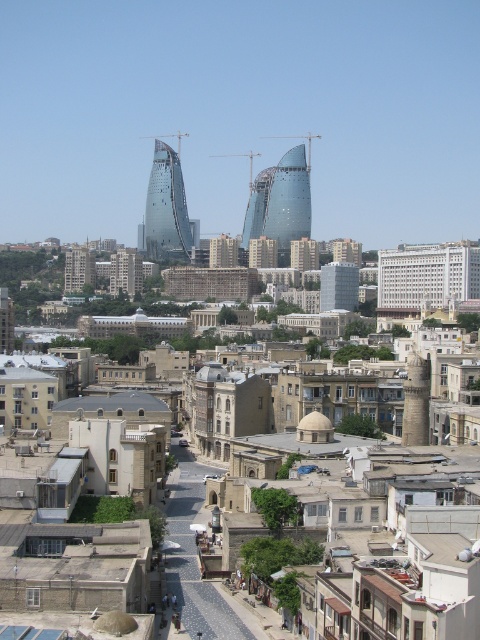
Question: Which is nearer to the glassy steel twin towers at center?

Choices:
 (A) glassy steel tower at center
 (B) matte glass building at center

Answer: (A)

Question: Is glassy steel twin towers at center in front of matte glass building at center?

Choices:
 (A) no
 (B) yes

Answer: (A)

Question: Does glassy steel tower at center have a greater width compared to matte glass building at center?

Choices:
 (A) no
 (B) yes

Answer: (B)

Question: Which of the following is the farthest from the observer?

Choices:
 (A) (298, 164)
 (B) (349, 307)

Answer: (A)

Question: Based on their relative distances, which object is farther from the glassy steel twin towers at center?

Choices:
 (A) matte glass building at center
 (B) glassy steel tower at center

Answer: (A)

Question: Is glassy steel twin towers at center to the left of matte glass building at center from the viewer's perspective?

Choices:
 (A) yes
 (B) no

Answer: (A)